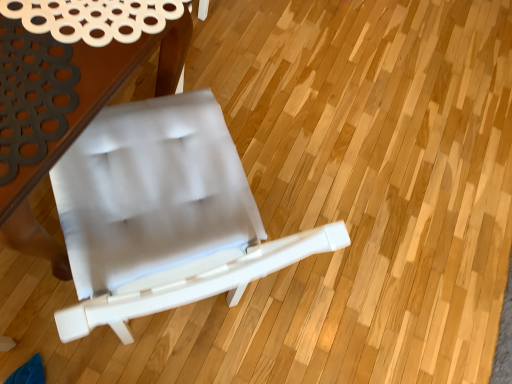
This screenshot has height=384, width=512. What do you see at coordinates (163, 215) in the screenshot?
I see `white fabric chair at center` at bounding box center [163, 215].

You are a GUI agent. You are given a task and a screenshot of the screen. Output one action in this format:
    pyautogui.click(x=<x>, y=<y>)
    Task: Click on the white fabric chair at center
    The image size is (512, 384).
    Given the screenshot: What is the action you would take?
    pyautogui.click(x=163, y=215)

Image resolution: width=512 pixels, height=384 pixels. Identify the location of white fabric table at upper left. (68, 97).

Measure the distance between white fabric table at upper left and camera.

The distance of white fabric table at upper left from camera is 57.37 centimeters.

Describe the element at coordinates (68, 97) in the screenshot. I see `white fabric table at upper left` at that location.

Image resolution: width=512 pixels, height=384 pixels. Find the location of `white fabric chair at center`. white fabric chair at center is located at coordinates (163, 215).

Considering the relative positions of white fabric chair at center and white fabric table at upper left in the image provided, is white fabric chair at center to the right of white fabric table at upper left from the viewer's perspective?

Yes.

Is white fabric chair at center closer to the viewer compared to white fabric table at upper left?

Yes, white fabric chair at center is closer to the viewer.

Which is in front, point (268, 253) or point (157, 12)?

Point (268, 253)

From the picture: From the image's perspective, is white fabric chair at center beneath white fabric table at upper left?

Yes, from the image's perspective, white fabric chair at center is below white fabric table at upper left.

From a real-world perspective, is white fabric chair at center under white fabric table at upper left?

No, from a real-world perspective, white fabric chair at center is not under white fabric table at upper left.

Which object is thinner, white fabric chair at center or white fabric table at upper left?

white fabric chair at center is thinner.

Consider the image. Is white fabric chair at center taller or shorter than white fabric table at upper left?

white fabric chair at center is taller than white fabric table at upper left.

Which of these two, white fabric chair at center or white fabric table at upper left, is smaller?

Smaller between the two is white fabric chair at center.

Is white fabric chair at center completely or partially outside of white fabric table at upper left?

white fabric chair at center is positioned outside white fabric table at upper left.

Is white fabric chair at center with white fabric table at upper left?

No, white fabric chair at center is not next to white fabric table at upper left.

Is white fabric chair at center looking in the opposite direction of white fabric table at upper left?

No, white fabric chair at center's orientation is not away from white fabric table at upper left.

What's the angular difference between white fabric chair at center and white fabric table at upper left's facing directions?

The facing directions of white fabric chair at center and white fabric table at upper left are 138 degrees apart.

The height and width of the screenshot is (384, 512). Identify the location of chair above the white fabric table at upper left (from a real-world perspective). (163, 215).

Would you say white fabric table at upper left is to the left or to the right of white fabric chair at center in the picture?

Based on their positions, white fabric table at upper left is located to the left of white fabric chair at center.

Does white fabric table at upper left lie behind white fabric chair at center?

Yes, white fabric table at upper left is behind white fabric chair at center.

Is point (87, 56) closer or farther from the camera than point (103, 132)?

Point (87, 56) is closer to the camera than point (103, 132).

From the image's perspective, is white fabric table at upper left below white fabric chair at center?

Actually, white fabric table at upper left appears above white fabric chair at center in the image.

From a real-world perspective, is white fabric table at upper left below white fabric chair at center?

Yes.

Between white fabric table at upper left and white fabric chair at center, which one has smaller width?

white fabric chair at center.

Is white fabric table at upper left shorter than white fabric chair at center?

Yes.

Between white fabric table at upper left and white fabric chair at center, which one has larger size?

Bigger between the two is white fabric table at upper left.

Does white fabric table at upper left contain white fabric chair at center?

Actually, white fabric chair at center is outside white fabric table at upper left.

Are white fabric table at upper left and white fabric chair at center far apart?

No, white fabric table at upper left is not far away from white fabric chair at center.

Is white fabric table at upper left aimed at white fabric chair at center?

Yes, white fabric table at upper left is turned towards white fabric chair at center.

Locate an element on the screen. table above the white fabric chair at center (from the image's perspective) is located at coordinates (68, 97).

Identify the location of table on the left side of white fabric chair at center. (68, 97).

This screenshot has width=512, height=384. Identify the location of table that appears above the white fabric chair at center (from the image's perspective). (68, 97).